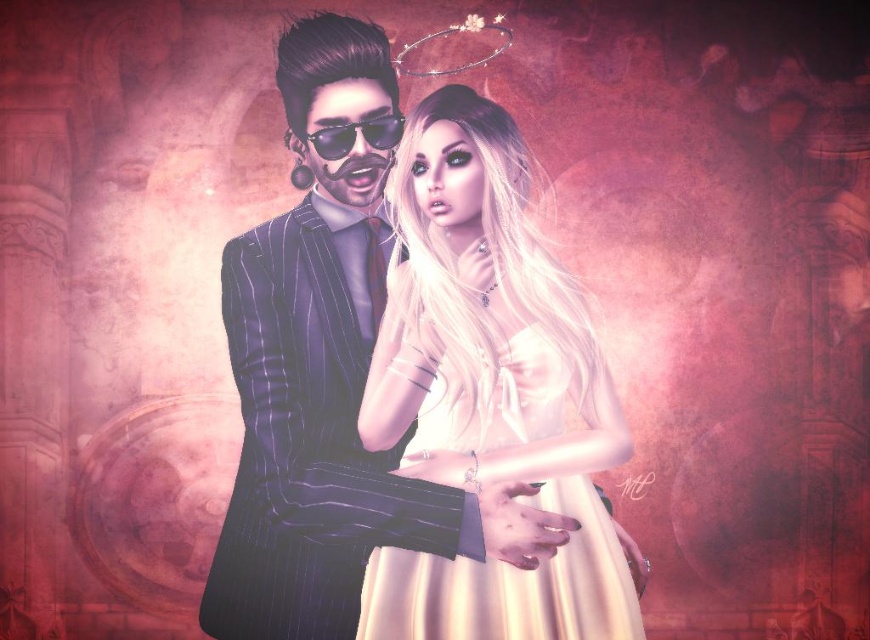
Question: Which point is closer to the camera taking this photo?

Choices:
 (A) tap(533, 570)
 (B) tap(392, 465)

Answer: (A)

Question: Which of the following is the closest to the observer?

Choices:
 (A) (396, 397)
 (B) (380, 129)

Answer: (A)

Question: Does shiny black suit at center have a lesser width compared to satin cream dress at center?

Choices:
 (A) yes
 (B) no

Answer: (B)

Question: Which point appears closest to the camera in this image?

Choices:
 (A) [x=395, y=516]
 (B) [x=432, y=634]
 (C) [x=345, y=150]

Answer: (A)

Question: From the image, what is the correct spatial relationship of shiny black suit at center in relation to dark pinstripe suit at center?

Choices:
 (A) left
 (B) right

Answer: (B)

Question: Is shiny black suit at center in front of black reflective sunglasses at upper center?

Choices:
 (A) yes
 (B) no

Answer: (A)